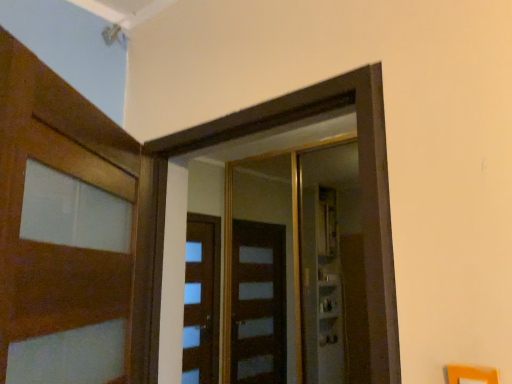
Question: Is wooden door at left surrounding transparent glass elevator at center, the 2th elevator from the front?

Choices:
 (A) no
 (B) yes

Answer: (A)

Question: Would you say wooden door at left is a long distance from transparent glass elevator at center, the 2th elevator from the front?

Choices:
 (A) no
 (B) yes

Answer: (B)

Question: Is wooden door at left smaller than transparent glass elevator at center, the 1th elevator when ordered from back to front?

Choices:
 (A) yes
 (B) no

Answer: (A)

Question: Is wooden door at left to the left of transparent glass elevator at center, the 2th elevator from the front, from the viewer's perspective?

Choices:
 (A) no
 (B) yes

Answer: (B)

Question: Is wooden door at left turned away from transparent glass elevator at center, the 2th elevator from the front?

Choices:
 (A) no
 (B) yes

Answer: (A)

Question: From the image's perspective, does wooden door at left appear lower than transparent glass elevator at center, the 2th elevator from the front?

Choices:
 (A) yes
 (B) no

Answer: (B)

Question: Is wooden door at center, placed as the 1th elevator when sorted from front to back, a part of wooden door at left?

Choices:
 (A) yes
 (B) no

Answer: (B)

Question: Considering the relative positions of wooden door at left and wooden door at center, the second elevator viewed from the back, in the image provided, is wooden door at left to the right of wooden door at center, the second elevator viewed from the back, from the viewer's perspective?

Choices:
 (A) no
 (B) yes

Answer: (A)

Question: Does wooden door at left have a smaller size compared to wooden door at center, the second elevator viewed from the back?

Choices:
 (A) yes
 (B) no

Answer: (B)

Question: Is wooden door at center, the second elevator viewed from the back, at the back of wooden door at left?

Choices:
 (A) yes
 (B) no

Answer: (A)

Question: From a real-world perspective, is wooden door at left under wooden door at center, the second elevator viewed from the back?

Choices:
 (A) yes
 (B) no

Answer: (A)

Question: Does wooden door at left have a greater height compared to wooden door at center, the second elevator viewed from the back?

Choices:
 (A) no
 (B) yes

Answer: (A)

Question: Is transparent glass elevator at center, the 1th elevator when ordered from back to front, next to wooden door at left?

Choices:
 (A) yes
 (B) no

Answer: (B)